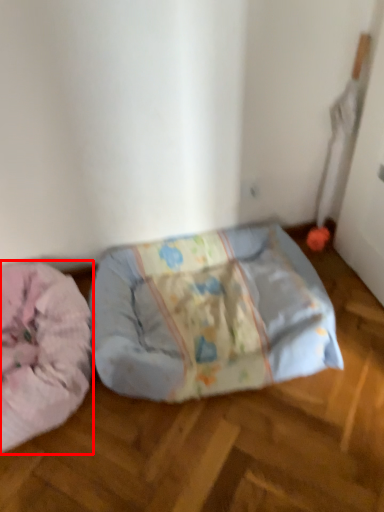
Question: In this image, where is dog bed (annotated by the red box) located relative to furniture?

Choices:
 (A) right
 (B) left

Answer: (B)